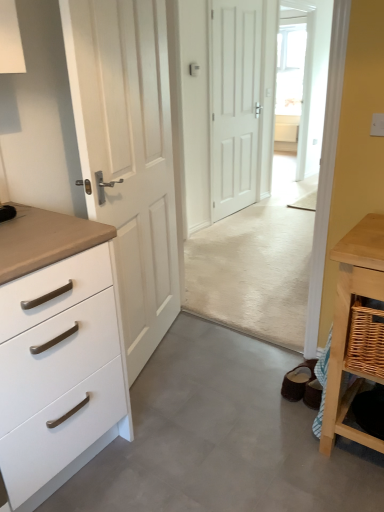
Find the location of a particular element. This screenshot has width=384, height=512. vacant space that is to the left of woven wood table at right is located at coordinates (282, 416).